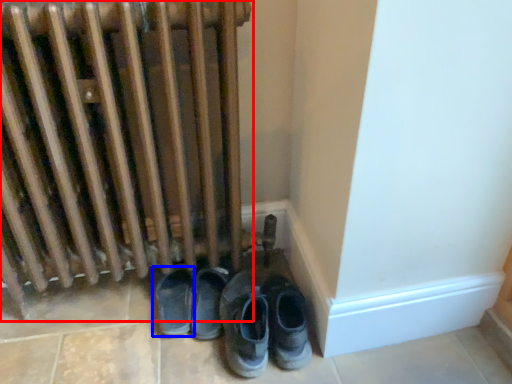
Question: Which object is further to the camera taking this photo, radiator (highlighted by a red box) or footwear (highlighted by a blue box)?

Choices:
 (A) radiator
 (B) footwear

Answer: (B)